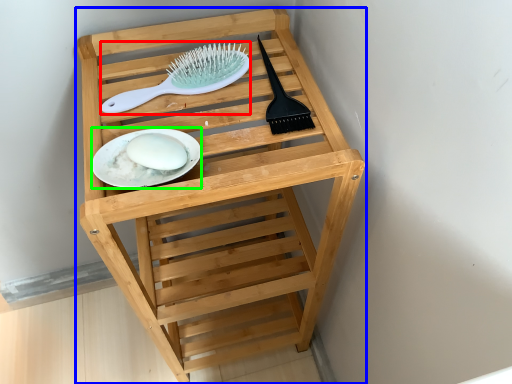
Question: Considering the real-world distances, which object is closest to brush (highlighted by a red box)? furniture (highlighted by a blue box) or plate (highlighted by a green box).

Choices:
 (A) furniture
 (B) plate

Answer: (B)